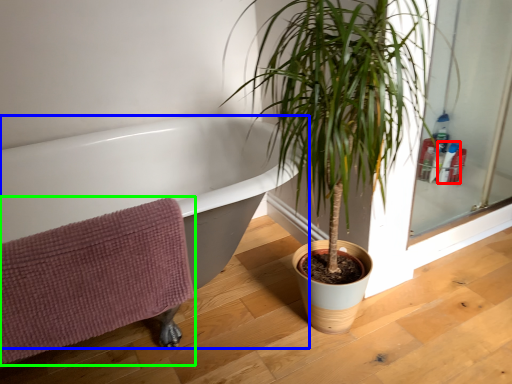
Question: Which object is the farthest from toiletry (highlighted by a red box)? Choose among these: bathtub (highlighted by a blue box) or bath towel (highlighted by a green box).

Choices:
 (A) bathtub
 (B) bath towel

Answer: (B)